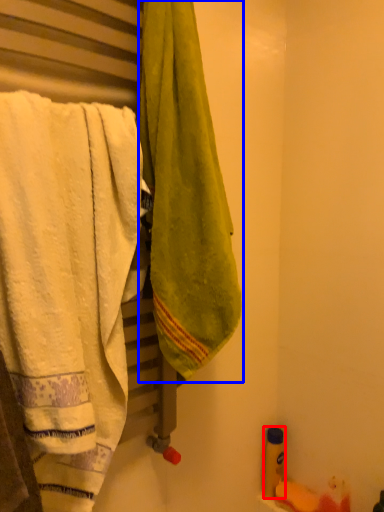
Question: Which object appears farthest to the camera in this image, toiletry (highlighted by a red box) or towel (highlighted by a blue box)?

Choices:
 (A) toiletry
 (B) towel

Answer: (A)